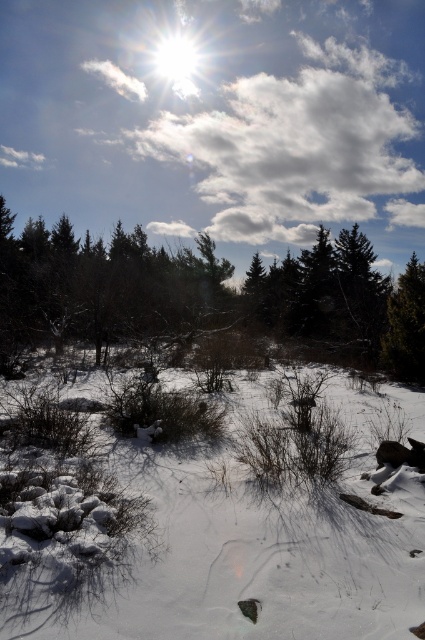
Question: Among these objects, which one is nearest to the camera?

Choices:
 (A) white powdery snow at center
 (B) brown textured tree at center
 (C) green matte tree at right

Answer: (A)

Question: Which of the following is the farthest from the observer?

Choices:
 (A) (405, 202)
 (B) (73, 413)
 (C) (263, 321)
 (D) (399, 358)

Answer: (A)

Question: Does white powdery snow at center have a smaller size compared to green matte tree at right?

Choices:
 (A) no
 (B) yes

Answer: (B)

Question: Can you confirm if white fluffy cloud at upper center is smaller than green matte tree at right?

Choices:
 (A) no
 (B) yes

Answer: (A)

Question: Can you confirm if white fluffy cloud at upper center is bigger than green matte tree at right?

Choices:
 (A) yes
 (B) no

Answer: (A)

Question: Which point is farther to the camera?

Choices:
 (A) (257, 305)
 (B) (357, 540)
 (C) (408, 284)

Answer: (A)